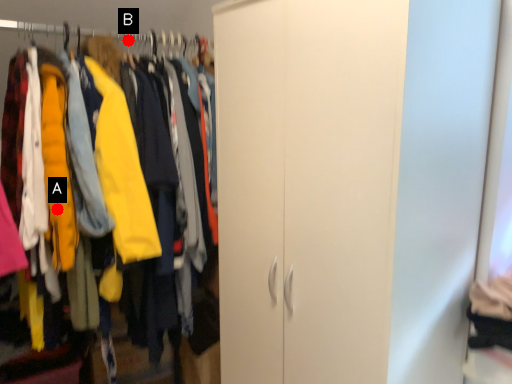
Question: Two points are circled on the image, labeled by A and B beside each circle. Among these points, which one is farthest from the camera?

Choices:
 (A) A is further
 (B) B is further

Answer: (B)